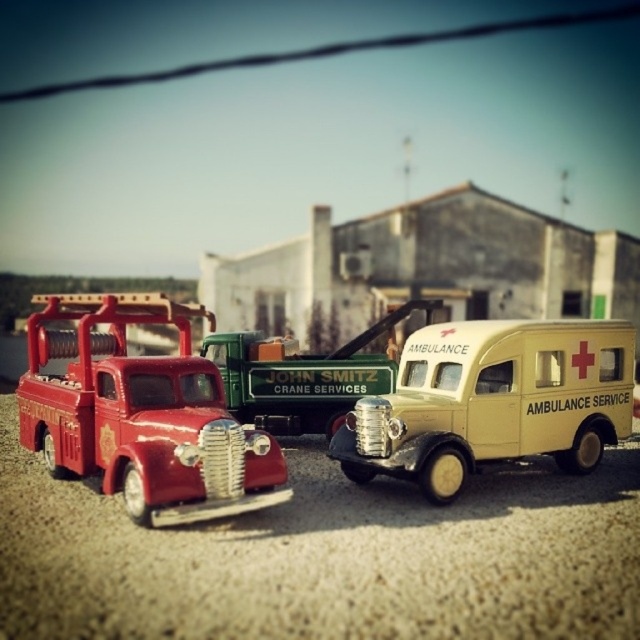
Is matte red truck at left shorter than beige matte ambulance service vehicle at center?

No.

Can you confirm if matte red truck at left is positioned below beige matte ambulance service vehicle at center?

No.

Between point (173, 416) and point (576, 336), which one is positioned in front?

Positioned in front is point (173, 416).

Locate an element on the screen. The image size is (640, 640). matte red truck at left is located at coordinates (141, 413).

Locate an element on the screen. smooth gravel at center is located at coordinates (326, 557).

Does smooth gravel at center have a greater width compared to beige matte ambulance service vehicle at center?

Yes.

This screenshot has height=640, width=640. Describe the element at coordinates (326, 557) in the screenshot. I see `smooth gravel at center` at that location.

Image resolution: width=640 pixels, height=640 pixels. I want to click on smooth gravel at center, so pos(326,557).

Is smooth gravel at center below matte red truck at left?

Correct, smooth gravel at center is located below matte red truck at left.

Can you confirm if smooth gravel at center is thinner than matte red truck at left?

Incorrect, smooth gravel at center's width is not less than matte red truck at left's.

Locate an element on the screen. smooth gravel at center is located at coordinates (326, 557).